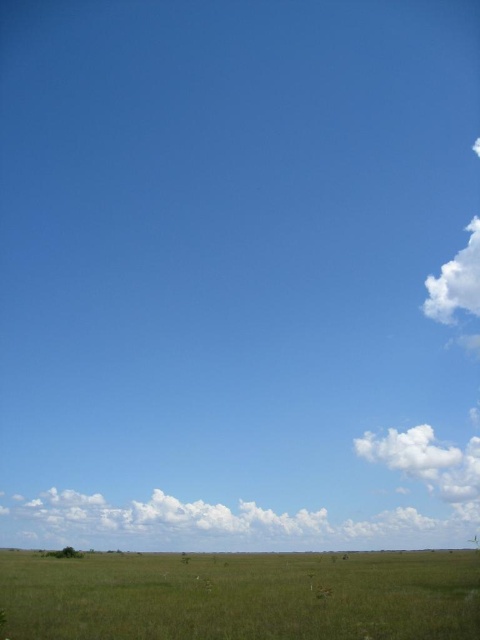
Based on the photo, you are standing in the middle of the grassland and looking up at the sky. Which direction should you turn your head to see the white fluffy cloud at lower center?

The white fluffy cloud at lower center is located at point [201,524], which is slightly to the right and lower in the sky. Since you are standing in the middle of the grassland, you should turn your head slightly to the right and look downward to see it.

You are an airplane pilot flying at a low altitude and see the green grassy field at lower center and the white fluffy cloud at lower center. Which object is bigger in your view?

The green grassy field at lower center is larger in size compared to the white fluffy cloud at lower center, so the green grassy field at lower center appears bigger in your view.